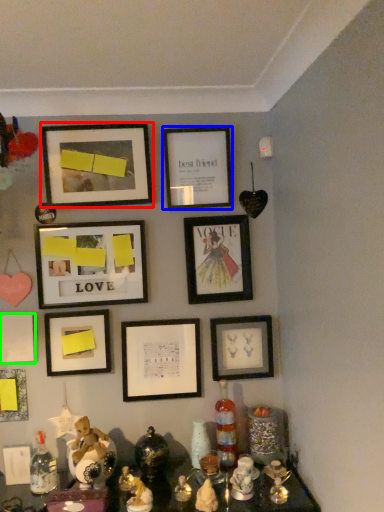
Question: Considering the real-world distances, which object is closest to picture frame (highlighted by a red box)? picture frame (highlighted by a blue box) or picture frame (highlighted by a green box).

Choices:
 (A) picture frame
 (B) picture frame

Answer: (A)